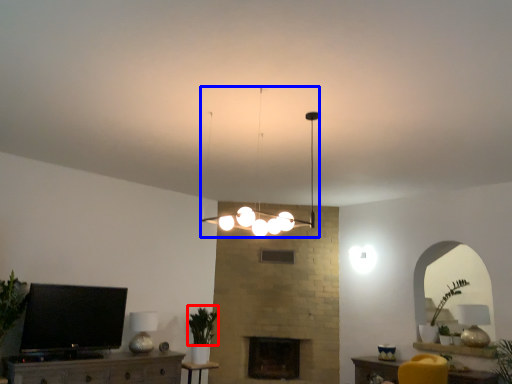
Question: Which object appears farthest to the camera in this image, plant (highlighted by a red box) or lamp (highlighted by a blue box)?

Choices:
 (A) plant
 (B) lamp

Answer: (A)